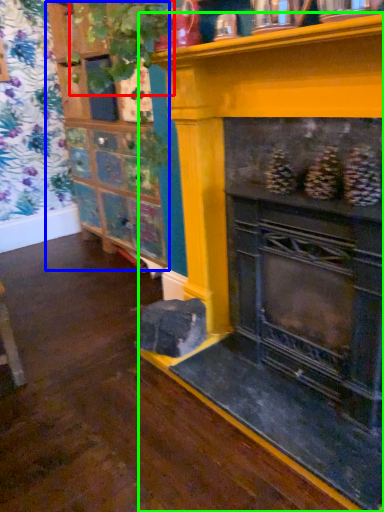
Question: Which is nearer to the plant (highlighted by a red box)? shelf (highlighted by a blue box) or fireplace (highlighted by a green box).

Choices:
 (A) shelf
 (B) fireplace

Answer: (B)